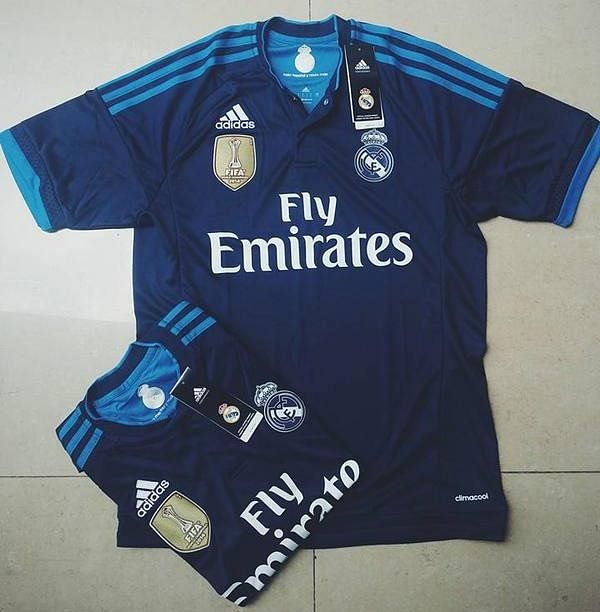
What are the coordinates of `greyish, white tile background` in the screenshot? It's located at (555, 58).